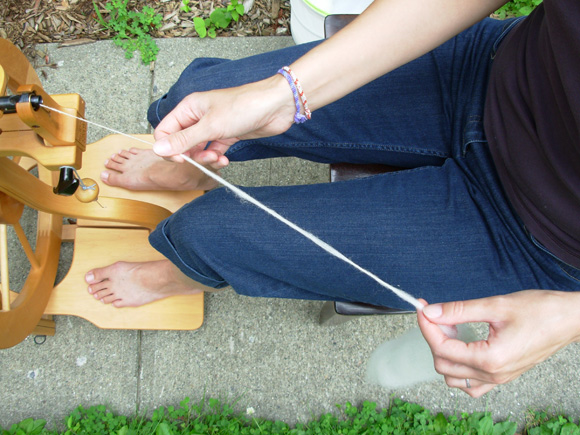
Image resolution: width=580 pixels, height=435 pixels. I want to click on black chair cushion, so click(335, 21).